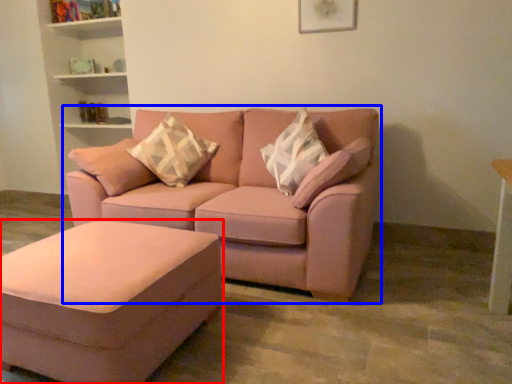
Question: Which object is further to the camera taking this photo, table (highlighted by a red box) or studio couch (highlighted by a blue box)?

Choices:
 (A) table
 (B) studio couch

Answer: (B)